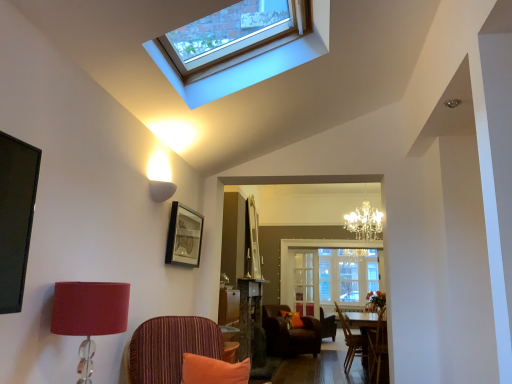
Question: In the image, is clear glass cabinet at center on the left side or the right side of white glass window screen at center?

Choices:
 (A) right
 (B) left

Answer: (B)

Question: From their relative heights in the image, would you say clear glass cabinet at center is taller or shorter than white glass window screen at center?

Choices:
 (A) tall
 (B) short

Answer: (B)

Question: Based on their relative distances, which object is farther from the matte red lampshade at left?

Choices:
 (A) matte black picture frame at upper center
 (B) velvet brown armchair at center
 (C) wooden chair at right, which is counted as the 2th chair, starting from the front
 (D) brown leather armchair at center, which is counted as the fourth chair, starting from the front
 (E) clear glass cabinet at center

Answer: (E)

Question: Which is nearer to the wooden chair at right, acting as the third chair starting from the back?

Choices:
 (A) clear glass window at upper center
 (B) striped fabric chair at center, the first chair from the front
 (C) matte red lampshade at left
 (D) wooden chair at lower right, acting as the second chair starting from the back
 (E) white glass window screen at center

Answer: (D)